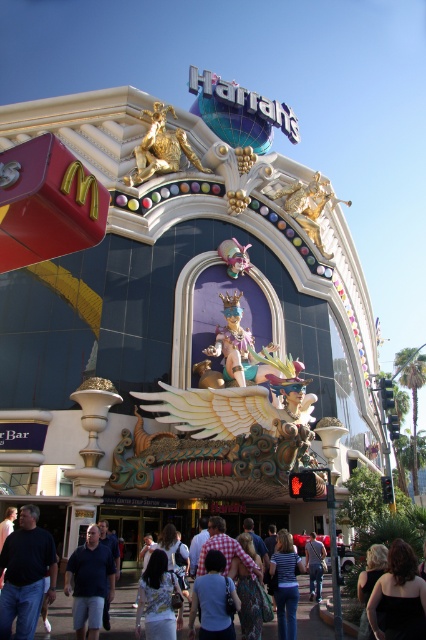
Question: In this image, where is checkered fabric dress at center located relative to denim jacket at lower center?

Choices:
 (A) left
 (B) right

Answer: (A)

Question: Which point appears farthest from the camera in this image?

Choices:
 (A) (250, 620)
 (B) (172, 605)
 (C) (414, 630)

Answer: (A)

Question: Which point is closer to the camera taking this photo?

Choices:
 (A) (92, 564)
 (B) (391, 627)

Answer: (B)

Question: Among these points, which one is nearest to the camera?

Choices:
 (A) (25, 572)
 (B) (230, 621)

Answer: (B)

Question: Does blue cotton shirt at center have a greater width compared to checkered fabric dress at center?

Choices:
 (A) yes
 (B) no

Answer: (B)

Question: Does striped fabric dress at center appear on the left side of checkered fabric dress at center?

Choices:
 (A) yes
 (B) no

Answer: (B)